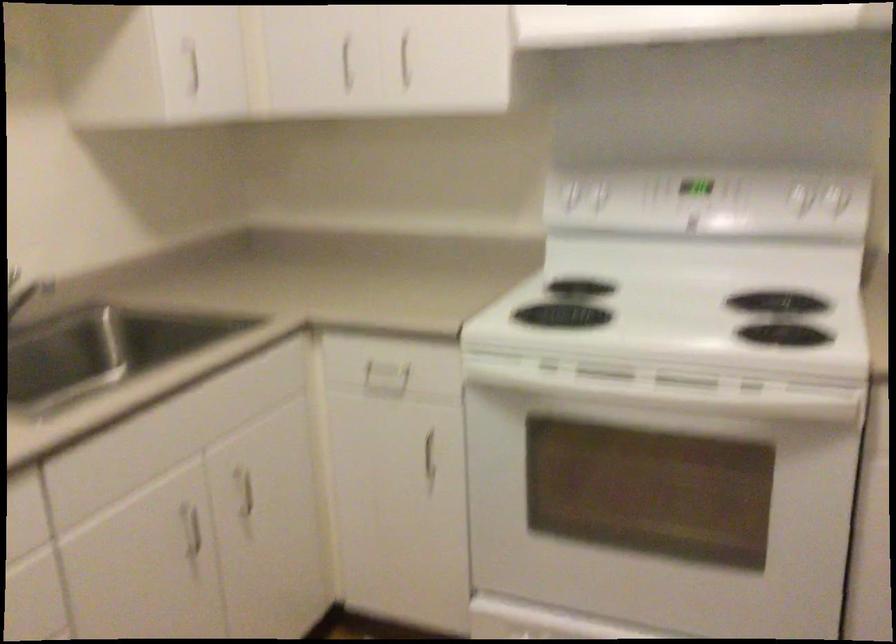
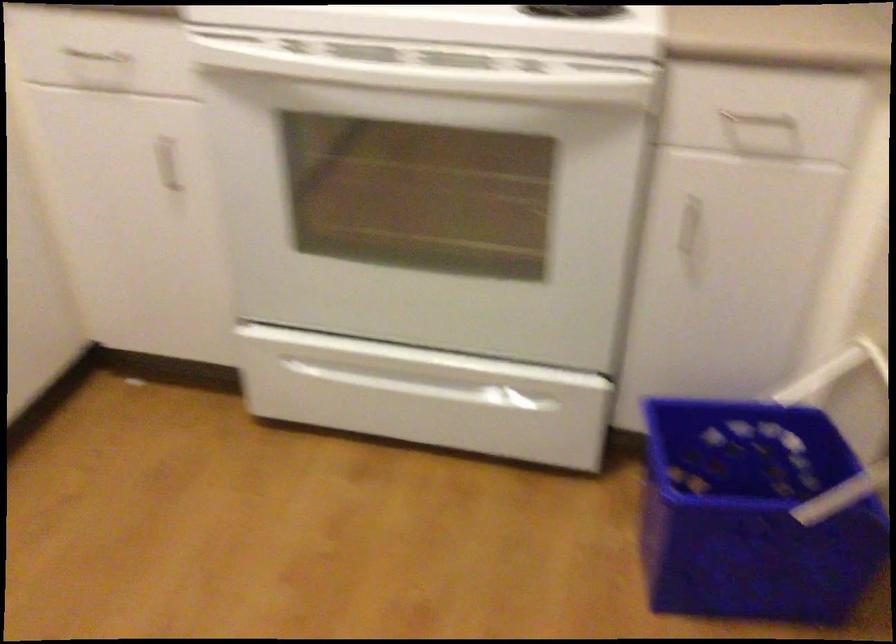
Locate, in the second image, the point that corresponds to point (424, 444) in the first image.

(167, 164)